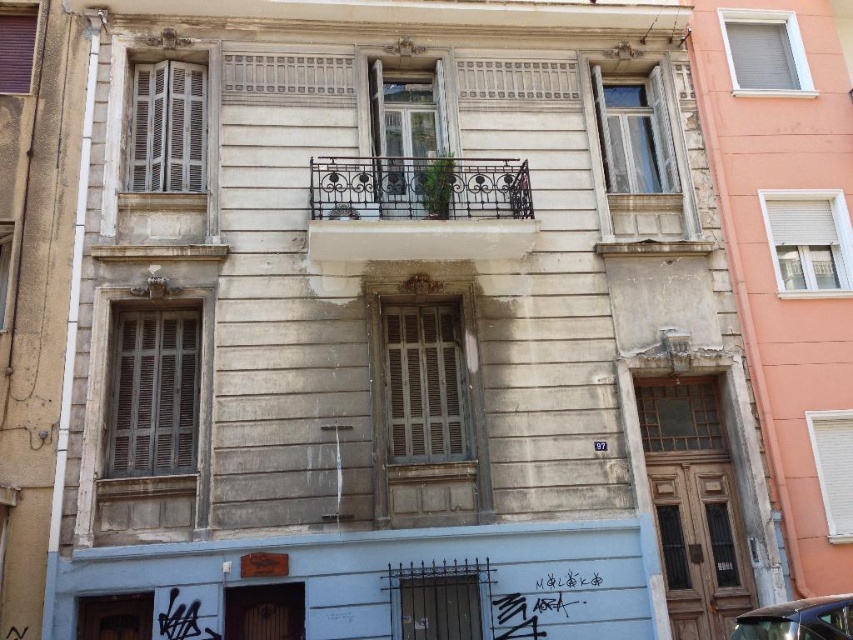
Can you confirm if black wrought iron balcony at center is positioned to the right of shiny black car at lower right?

In fact, black wrought iron balcony at center is to the left of shiny black car at lower right.

Between black wrought iron balcony at center and shiny black car at lower right, which one has more height?

black wrought iron balcony at center

Which is in front, point (412, 179) or point (811, 628)?

Positioned in front is point (811, 628).

This screenshot has height=640, width=853. I want to click on black wrought iron balcony at center, so click(x=418, y=209).